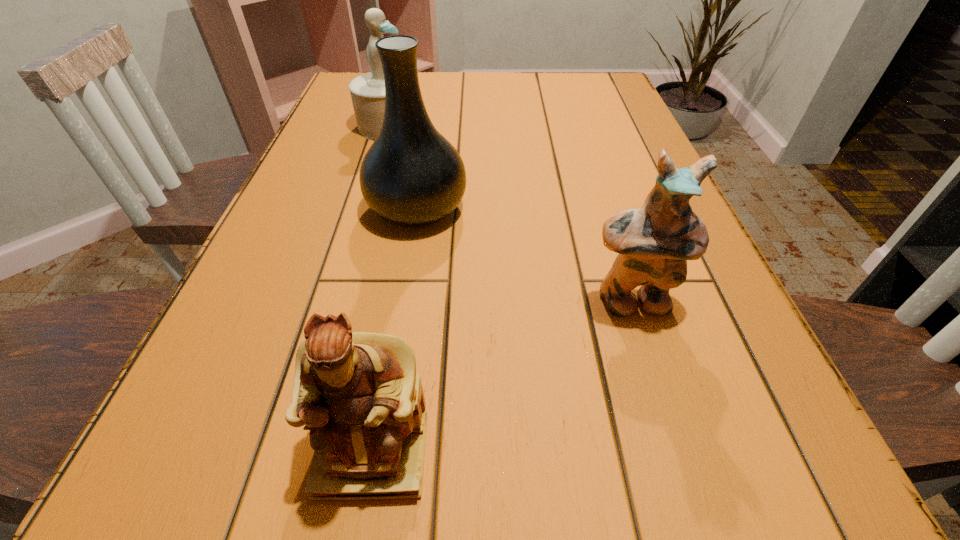
Locate an element on the screen. The height and width of the screenshot is (540, 960). vase is located at coordinates (412, 176).

This screenshot has width=960, height=540. I want to click on the farthest object, so click(367, 91).

In order to click on the second farthest figurine in this screenshot , I will do `click(654, 242)`.

Where is `the second nearest object`? The image size is (960, 540). the second nearest object is located at coordinates (654, 242).

You are a GUI agent. You are given a task and a screenshot of the screen. Output one action in this format:
    pyautogui.click(x=<x>, y=<y>)
    Task: Click on the nearest figurine
    Image resolution: width=960 pixels, height=540 pixels.
    Given the screenshot: What is the action you would take?
    pyautogui.click(x=359, y=394)

You are a GUI agent. You are given a task and a screenshot of the screen. Output one action in this format:
    pyautogui.click(x=<x>, y=<y>)
    Task: Click on the free space located on the back of the vase
    
    Given the screenshot: What is the action you would take?
    pyautogui.click(x=424, y=167)

You are a GUI agent. You are given a task and a screenshot of the screen. Output one action in this format:
    pyautogui.click(x=<x>, y=<y>)
    Task: Click on the vacant space located 0.140m at the beak of the farthest object
    Image resolution: width=960 pixels, height=540 pixels.
    Given the screenshot: What is the action you would take?
    pyautogui.click(x=474, y=126)

This screenshot has height=540, width=960. I want to click on free space located on the front-facing side of the third farthest object, so click(x=650, y=361).

You are a GUI agent. You are given a task and a screenshot of the screen. Output one action in this format:
    pyautogui.click(x=<x>, y=<y>)
    Task: Click on the object at the near edge
    The image size is (960, 540).
    Given the screenshot: What is the action you would take?
    pyautogui.click(x=359, y=394)

Locate an element on the screen. The image size is (960, 540). object located at the left edge is located at coordinates (367, 91).